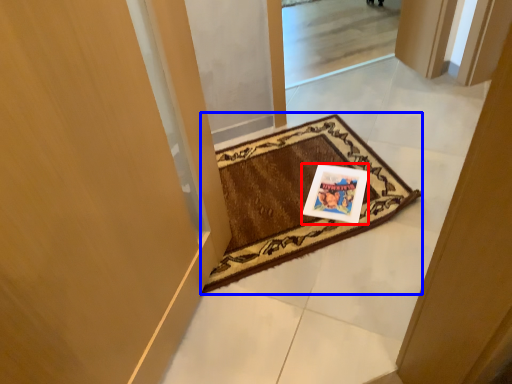
Question: Which object appears farthest to the camera in this image, postcard (highlighted by a red box) or mat (highlighted by a blue box)?

Choices:
 (A) postcard
 (B) mat

Answer: (A)